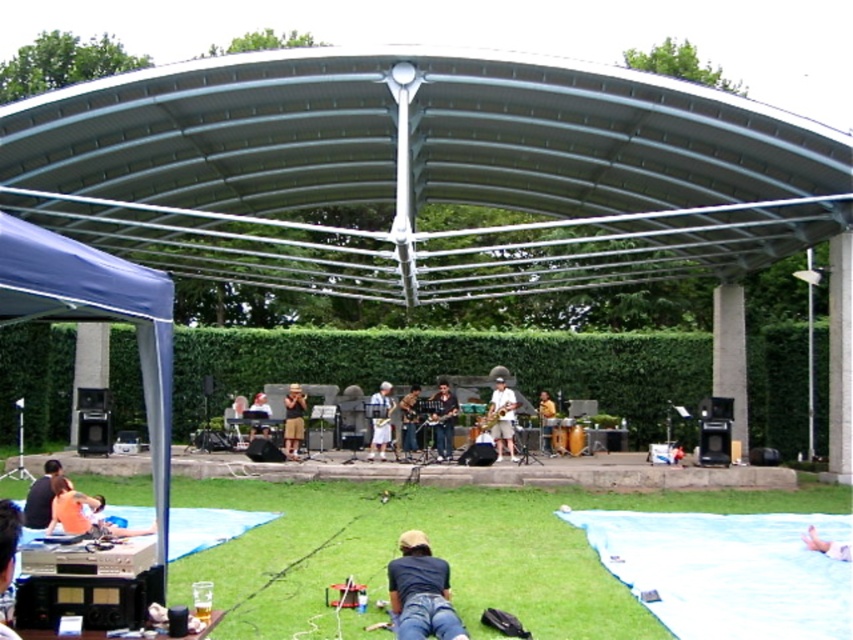
You are standing at the DJ setup on the left side of the frame and want to take a photo of both point (292, 548) and point (386, 392) in the scene. Which point will appear larger in your photo?

Point (292, 548) will appear larger in the photo because it is closer to the camera than point (386, 392).